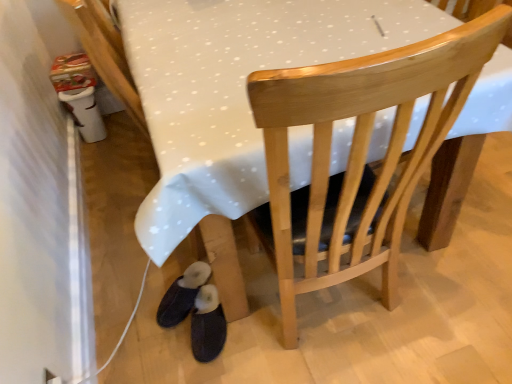
The image size is (512, 384). What are the coordinates of `vacant space to the left of black suede slippers at lower left, positioned as the first footwear in left-to-right order` in the screenshot? It's located at (140, 302).